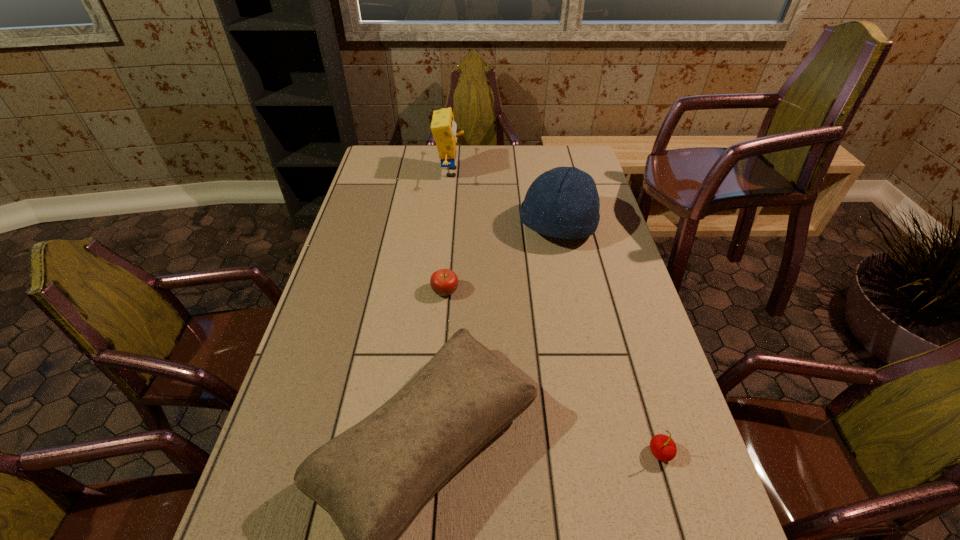
The width and height of the screenshot is (960, 540). I want to click on sponge, so click(x=443, y=127).

The width and height of the screenshot is (960, 540). Find the location of `the second tallest object`. the second tallest object is located at coordinates (563, 202).

This screenshot has width=960, height=540. Find the location of `the second farthest object`. the second farthest object is located at coordinates (563, 202).

In order to click on the second shortest object in this screenshot , I will do `click(663, 447)`.

Where is `the shortest object`? Image resolution: width=960 pixels, height=540 pixels. the shortest object is located at coordinates (444, 282).

Identify the location of apple. The image size is (960, 540). (444, 282).

Where is `vacant position located 0.330m on the face of the farthest object`? This screenshot has height=540, width=960. vacant position located 0.330m on the face of the farthest object is located at coordinates (547, 173).

Identify the location of free space located on the front of the fourth nearest object. This screenshot has height=540, width=960. (578, 325).

This screenshot has width=960, height=540. Identify the location of free region located on the back of the second shortest object. (644, 400).

Identify the location of vacant space located 0.090m on the back of the apple. This screenshot has height=540, width=960. (447, 261).